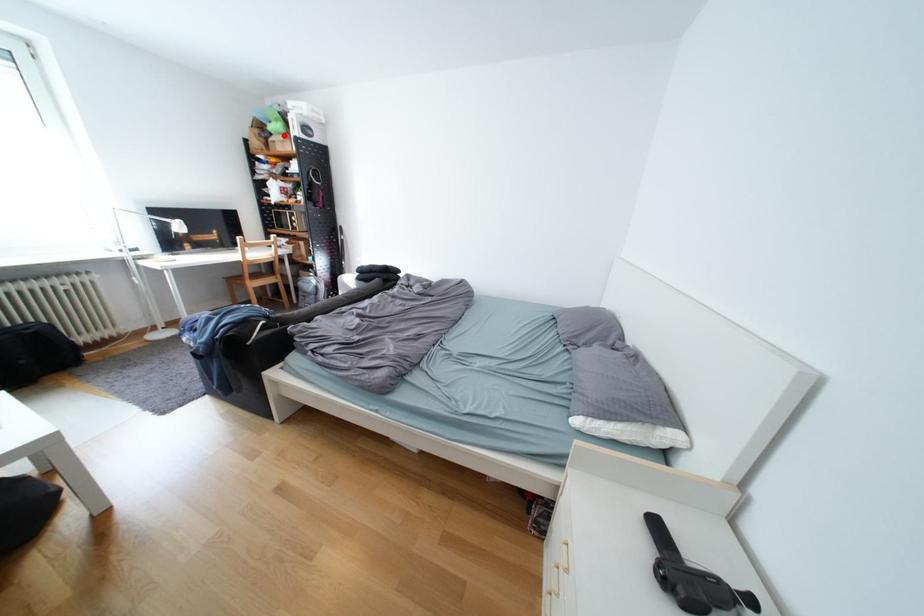
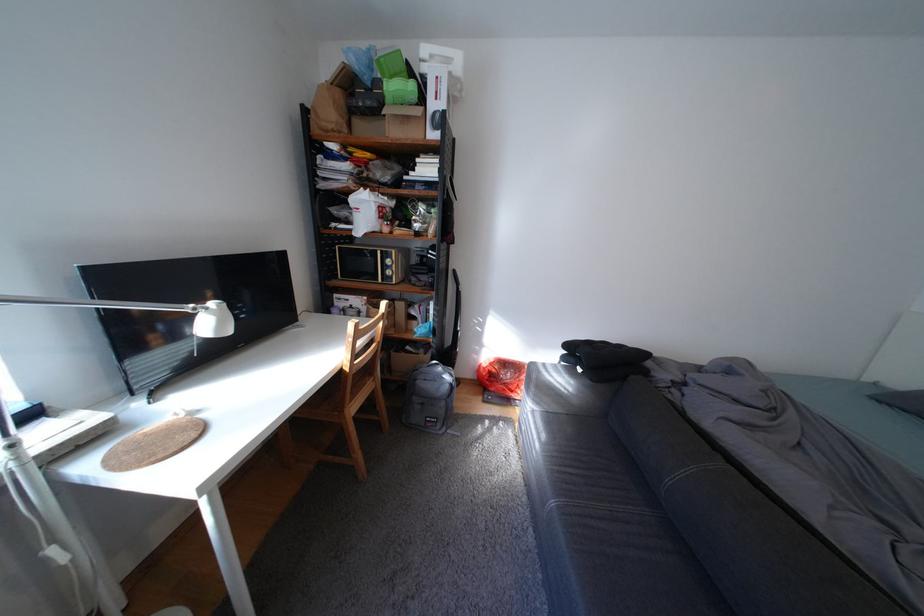
In the second image, find the point that corresponds to the highlighted location in the first image.

(395, 103)